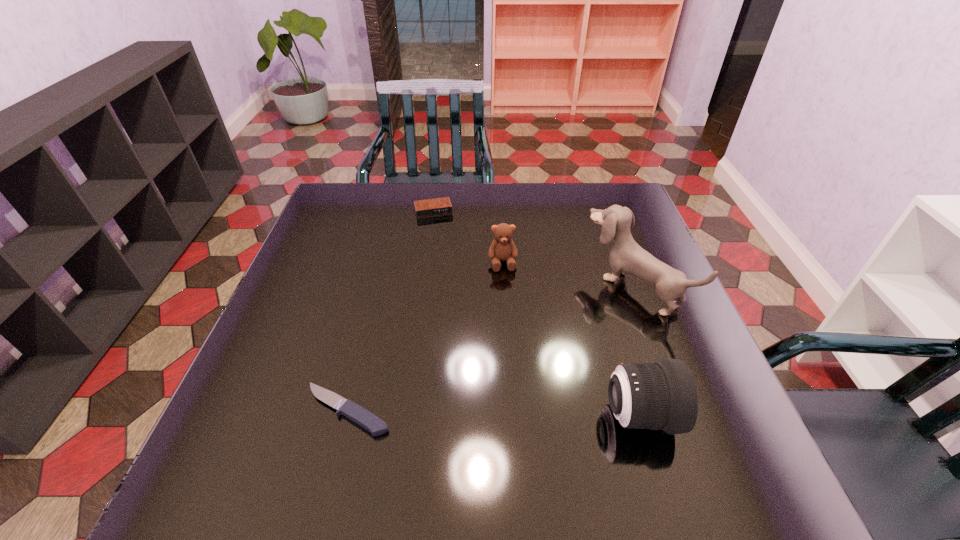
This screenshot has width=960, height=540. What are the coordinates of `vacant spot on the desktop that is between the steak knife and the fourth shortest object and is positioned on the face of the third tallest object` in the screenshot? It's located at (522, 413).

The height and width of the screenshot is (540, 960). Find the location of `free space on the desktop that is between the steak knife and the telephoto lens and is positioned at the face of the puppy`. free space on the desktop that is between the steak knife and the telephoto lens and is positioned at the face of the puppy is located at coordinates point(456,412).

You are a GUI agent. You are given a task and a screenshot of the screen. Output one action in this format:
    pyautogui.click(x=<x>, y=<y>)
    Task: Click on the free space on the desktop that is between the steak knife and the telephoto lens and is positioned on the front face of the alarm clock
    The width and height of the screenshot is (960, 540).
    Given the screenshot: What is the action you would take?
    pyautogui.click(x=487, y=413)